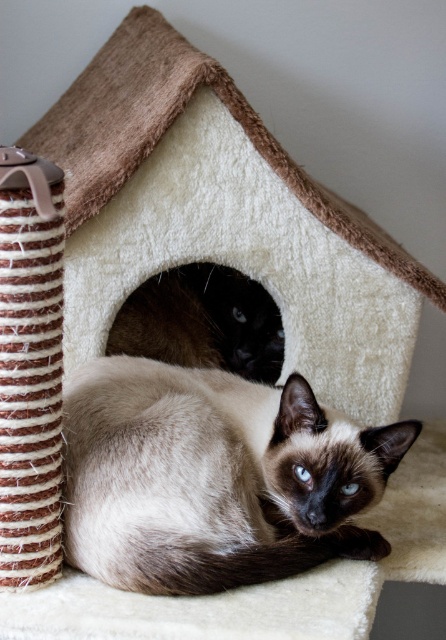
You are a cat owner trying to clean the area around the smokey brown fur cat at center and the smokey brown fur at center. Which one is easier to reach?

The smokey brown fur cat at center is closer to the viewer than the smokey brown fur at center, so it is easier to reach.

You are a cat owner who wants to place a new toy between the smokey brown fur cat at center and the smokey brown fur at center. Where should you place the toy so it is equidistant from both?

The toy should be placed directly between the smokey brown fur cat at center and the smokey brown fur at center since they are positioned one above the other, with the smokey brown fur cat at center below the smokey fur at center.

You are trying to determine the spatial relationship between the two objects in the scene. Which object is wider, the smokey brown fur cat at center or the smokey brown fur at center?

The smokey brown fur cat at center is wider than the smokey brown fur at center according to the description.